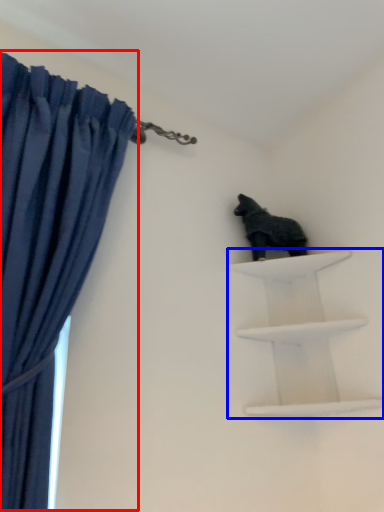
Question: Which object is further to the camera taking this photo, curtain (highlighted by a red box) or shelf (highlighted by a blue box)?

Choices:
 (A) curtain
 (B) shelf

Answer: (B)